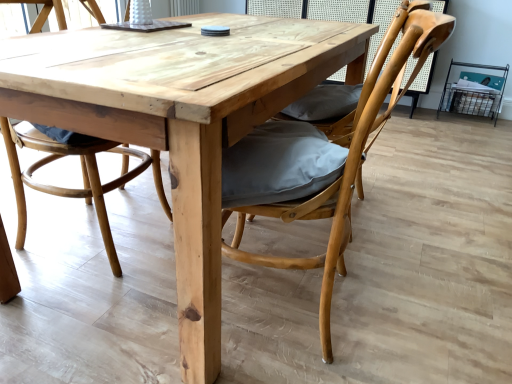
Question: Is natural wood chair at center, the first chair when ordered from left to right, shorter than natural wood chair at center, which is counted as the second chair, starting from the left?

Choices:
 (A) yes
 (B) no

Answer: (B)

Question: Considering the relative sizes of natural wood chair at center, the first chair when ordered from left to right, and natural wood chair at center, which appears as the first chair when viewed from the right, in the image provided, is natural wood chair at center, the first chair when ordered from left to right, taller than natural wood chair at center, which appears as the first chair when viewed from the right,?

Choices:
 (A) yes
 (B) no

Answer: (A)

Question: Can you confirm if natural wood chair at center, the first chair when ordered from left to right, is bigger than natural wood chair at center, which appears as the first chair when viewed from the right?

Choices:
 (A) no
 (B) yes

Answer: (A)

Question: Is natural wood chair at center, the first chair when ordered from left to right, with natural wood chair at center, which appears as the first chair when viewed from the right?

Choices:
 (A) no
 (B) yes

Answer: (A)

Question: From a real-world perspective, is natural wood chair at center, the first chair when ordered from left to right, positioned under natural wood chair at center, which is counted as the second chair, starting from the left, based on gravity?

Choices:
 (A) no
 (B) yes

Answer: (B)

Question: Does natural wood chair at center, the 2th chair viewed from the right, turn towards natural wood chair at center, which appears as the first chair when viewed from the right?

Choices:
 (A) yes
 (B) no

Answer: (A)

Question: Does natural wood chair at center, which appears as the first chair when viewed from the right, have a lesser height compared to natural wood chair at center, the first chair when ordered from left to right?

Choices:
 (A) yes
 (B) no

Answer: (A)

Question: From a real-world perspective, is natural wood chair at center, which is counted as the second chair, starting from the left, physically below natural wood chair at center, the 2th chair viewed from the right?

Choices:
 (A) yes
 (B) no

Answer: (B)

Question: Is natural wood chair at center, which appears as the first chair when viewed from the right, bigger than natural wood chair at center, the 2th chair viewed from the right?

Choices:
 (A) yes
 (B) no

Answer: (A)

Question: Is natural wood chair at center, the 2th chair viewed from the right, located within natural wood chair at center, which appears as the first chair when viewed from the right?

Choices:
 (A) yes
 (B) no

Answer: (B)

Question: Does natural wood chair at center, which appears as the first chair when viewed from the right, come behind natural wood chair at center, the first chair when ordered from left to right?

Choices:
 (A) yes
 (B) no

Answer: (B)

Question: From the image's perspective, is natural wood chair at center, which is counted as the second chair, starting from the left, located above natural wood chair at center, the first chair when ordered from left to right?

Choices:
 (A) no
 (B) yes

Answer: (A)

Question: Considering the relative sizes of natural wood chair at center, which is counted as the second chair, starting from the left, and natural wood table at center in the image provided, is natural wood chair at center, which is counted as the second chair, starting from the left, smaller than natural wood table at center?

Choices:
 (A) yes
 (B) no

Answer: (A)